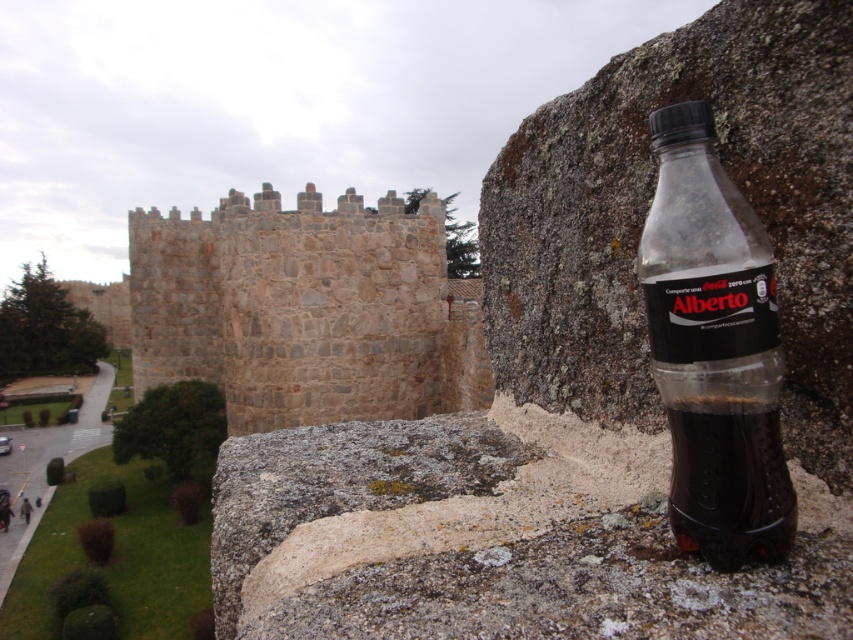
Question: In this image, where is stone wall at center located relative to translucent plastic bottle at right?

Choices:
 (A) below
 (B) above

Answer: (B)

Question: Which point is farther to the camera?

Choices:
 (A) translucent plastic bottle at right
 (B) stone wall at center

Answer: (B)

Question: Which point is farther from the camera taking this photo?

Choices:
 (A) (325, 272)
 (B) (730, 477)

Answer: (A)

Question: Is stone wall at center to the left of translucent plastic bottle at right from the viewer's perspective?

Choices:
 (A) no
 (B) yes

Answer: (B)

Question: Considering the relative positions of stone wall at center and translucent plastic bottle at right in the image provided, where is stone wall at center located with respect to translucent plastic bottle at right?

Choices:
 (A) below
 (B) above

Answer: (B)